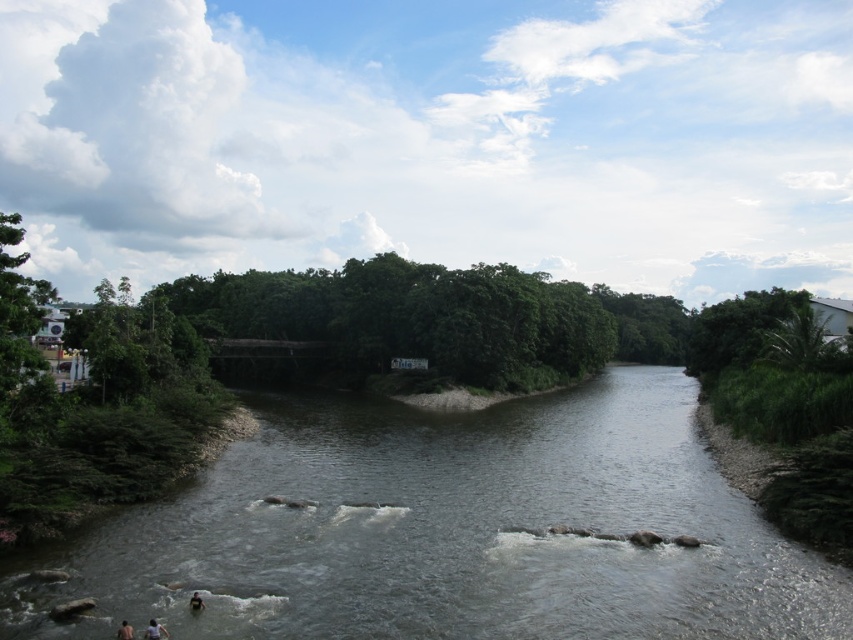
Question: Does white cotton shirt at lower left have a lesser width compared to dark skin human at center?

Choices:
 (A) no
 (B) yes

Answer: (A)

Question: Based on their relative distances, which object is nearer to the gray smooth river at center?

Choices:
 (A) skinny person at lower left
 (B) white cotton shirt at lower left

Answer: (B)

Question: Considering the relative positions of white cotton shirt at lower left and skinny person at lower left in the image provided, where is white cotton shirt at lower left located with respect to skinny person at lower left?

Choices:
 (A) right
 (B) left

Answer: (A)

Question: Is skinny person at lower left behind dark skin human at center?

Choices:
 (A) yes
 (B) no

Answer: (B)

Question: Which point is farther from the camera taking this photo?

Choices:
 (A) (x=190, y=604)
 (B) (x=486, y=502)
 (C) (x=149, y=621)
 (D) (x=129, y=627)

Answer: (B)

Question: Which of the following is the farthest from the observer?

Choices:
 (A) dark skin human at center
 (B) skinny person at lower left
 (C) white cotton shirt at lower left
 (D) gray smooth river at center

Answer: (A)